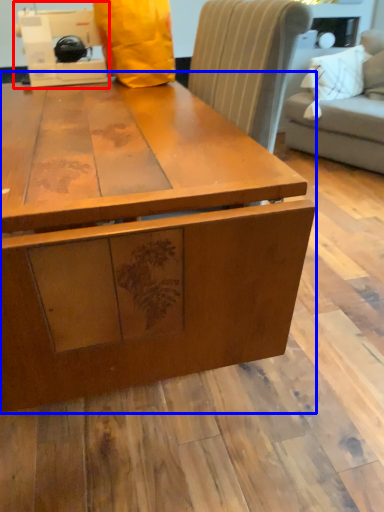
Question: Which of the following is the farthest to the observer, sewing machine (highlighted by a red box) or table (highlighted by a blue box)?

Choices:
 (A) sewing machine
 (B) table

Answer: (A)